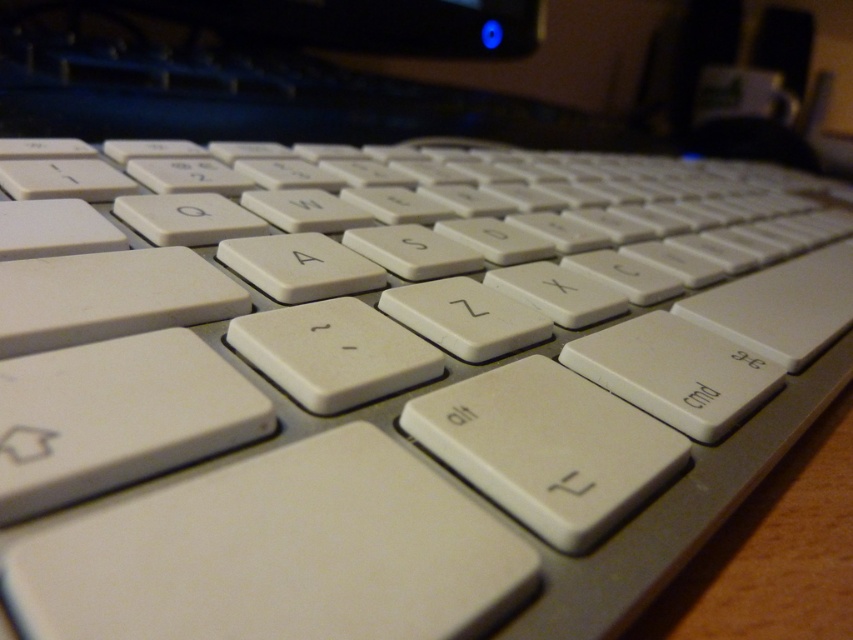
You are setting up a dual keyboard system for a streaming setup. You need to place both keyboards so that there is at least 1 meter between them to accommodate your arms. Based on the image, will the current spacing between the white plastic keyboard at upper center and the white matte keyboard at right work for your setup?

The white plastic keyboard at upper center and the white matte keyboard at right are 97.06 centimeters apart, which is less than 1 meter. Therefore, the current spacing is insufficient for your setup requiring at least 1 meter between them.

You are setting up a dual keyboard setup for your desk. You have two keyboards in front of you, the white plastic keyboard at upper center and the white matte keyboard at right. Which one is taller and would require a higher desk space?

The white plastic keyboard at upper center has a greater height compared to the white matte keyboard at right, so it would require more desk space vertically.

From the picture: You are holding a smartphone that is 6 inches long. You want to place it on the white plastic keyboard at upper center. Can the smartphone fit horizontally on the keyboard?

The white plastic keyboard at upper center is 28.96 inches wide, so yes, the smartphone can fit horizontally on the white plastic keyboard at upper center since it is wider than the smartphone.